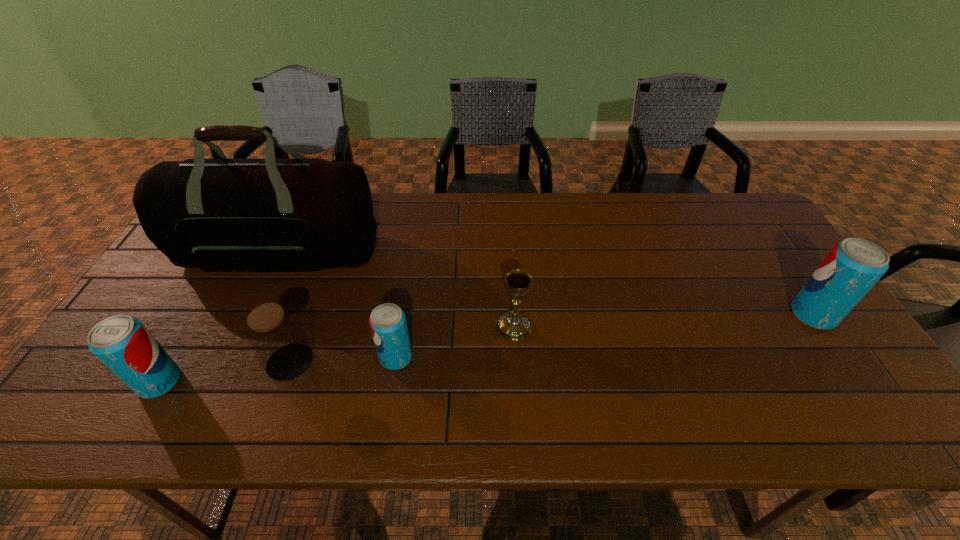
The width and height of the screenshot is (960, 540). Identify the location of free space that satisfies the following two spatial constraints: 1. on the back side of the rightmost soda can; 2. on the right side of the jar. (306, 315).

Identify the location of free space that satisfies the following two spatial constraints: 1. on the front pocket of the tallest object; 2. on the right side of the jar. (231, 362).

Locate an element on the screen. The image size is (960, 540). free point that satisfies the following two spatial constraints: 1. on the front pocket of the farthest object; 2. on the right side of the chalice is located at coordinates point(248,326).

The image size is (960, 540). Identify the location of vacant area in the image that satisfies the following two spatial constraints: 1. on the front pocket of the farthest object; 2. on the right side of the farthest soda can. (252, 315).